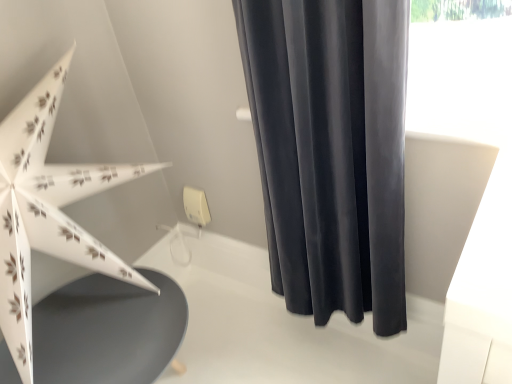
Question: Is matte gray table at lower left in front of or behind dark gray velvet curtain at upper right in the image?

Choices:
 (A) behind
 (B) front

Answer: (A)

Question: In terms of size, does matte gray table at lower left appear bigger or smaller than dark gray velvet curtain at upper right?

Choices:
 (A) big
 (B) small

Answer: (A)

Question: Which object is positioned farthest from the matte gray table at lower left?

Choices:
 (A) white paper umbrella at left
 (B) dark gray velvet curtain at upper right

Answer: (B)

Question: Which object is the farthest from the matte gray table at lower left?

Choices:
 (A) white paper umbrella at left
 (B) dark gray velvet curtain at upper right

Answer: (B)